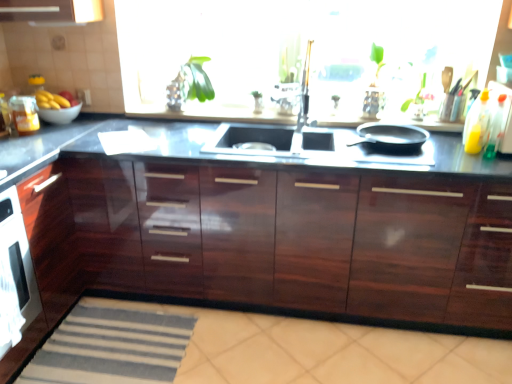
Locate an element on the screen. blank space situated above white glossy bowl at upper left (from a real-world perspective) is located at coordinates click(x=61, y=106).